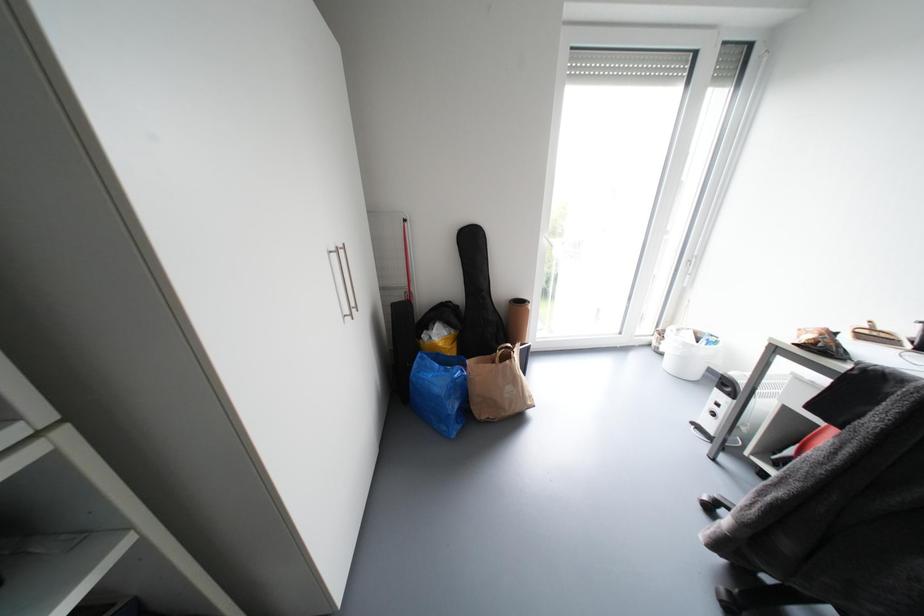
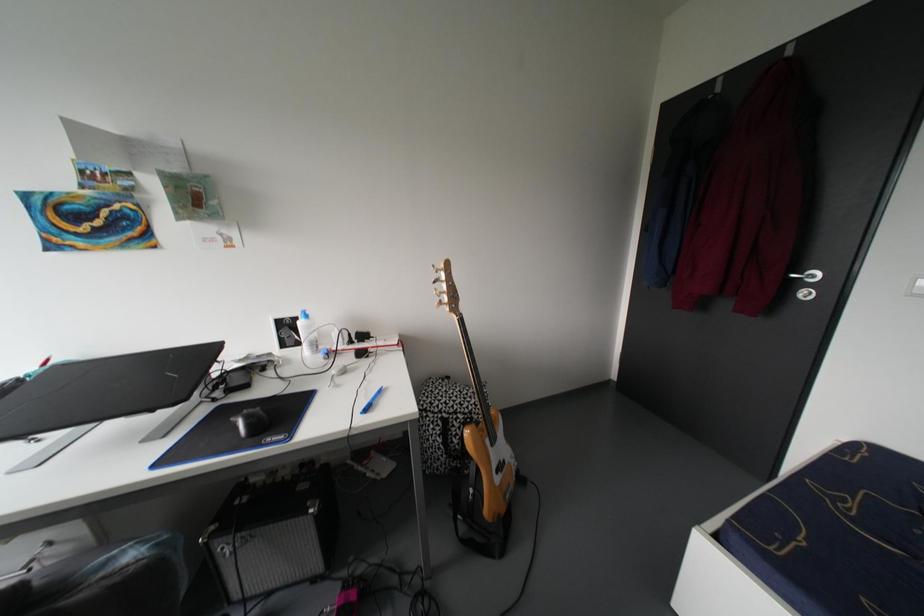
How did the camera likely rotate?

The camera's rotation is toward right-down.